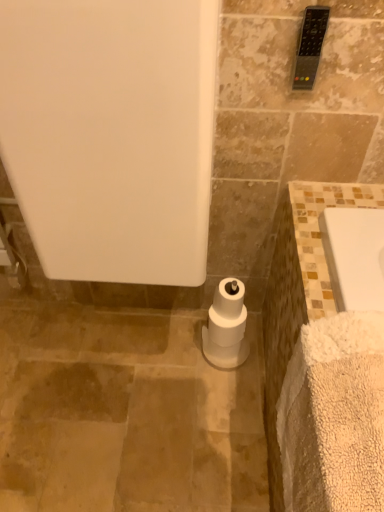
Where is `free space to the left of white matte toilet paper at center`? Image resolution: width=384 pixels, height=512 pixels. free space to the left of white matte toilet paper at center is located at coordinates (177, 354).